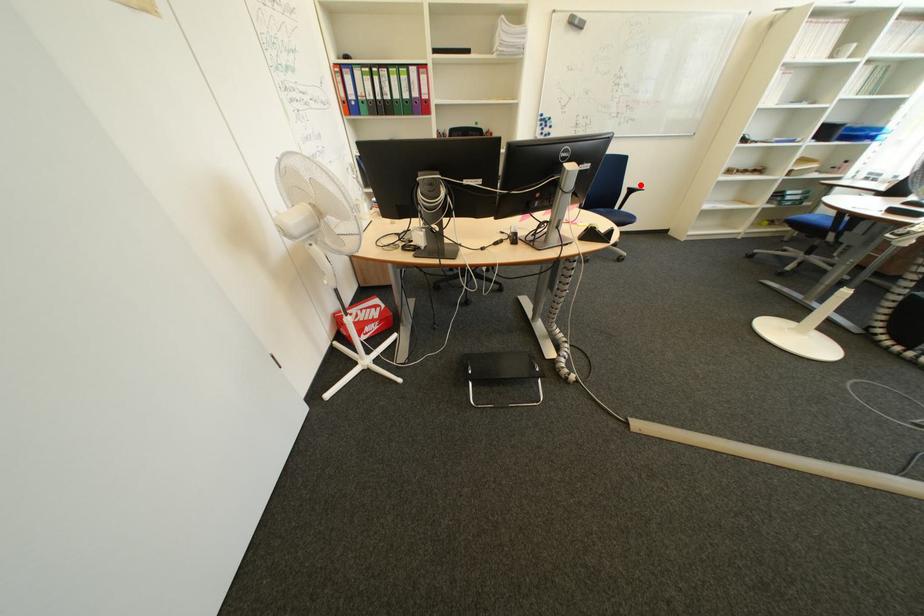
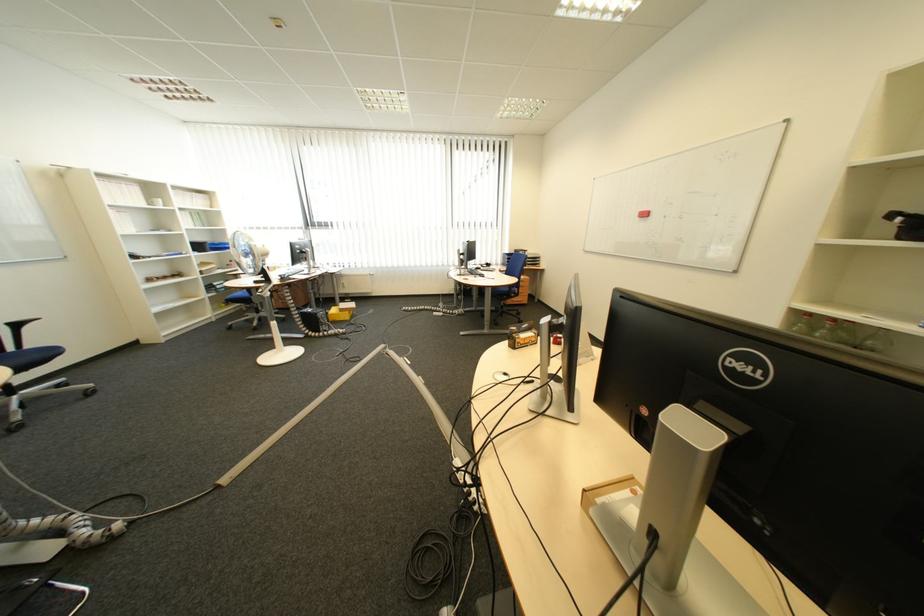
The point at the highlighted location is marked in the first image. Where is the corresponding point in the second image?

(13, 321)